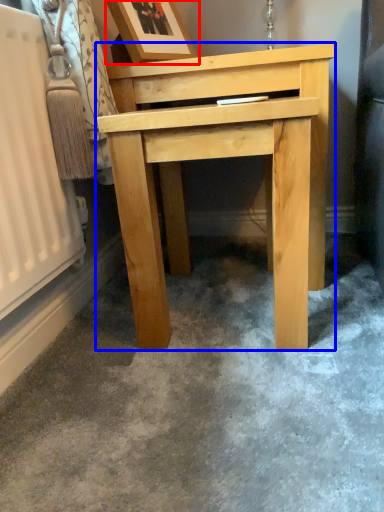
Question: Which of the following is the closest to the observer, picture frame (highlighted by a red box) or table (highlighted by a blue box)?

Choices:
 (A) picture frame
 (B) table

Answer: (B)